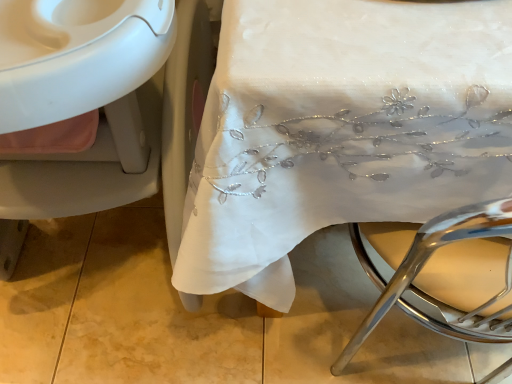
Describe the element at coordinates (341, 130) in the screenshot. I see `white sheer fabric at center` at that location.

In order to face white sheer fabric at center, should I rotate leftwards or rightwards?

You should rotate right by 24.722 degrees.

Where is `white sheer fabric at center`? The height and width of the screenshot is (384, 512). white sheer fabric at center is located at coordinates (341, 130).

Image resolution: width=512 pixels, height=384 pixels. What are the coordinates of `white sheer fabric at center` in the screenshot? It's located at [x=341, y=130].